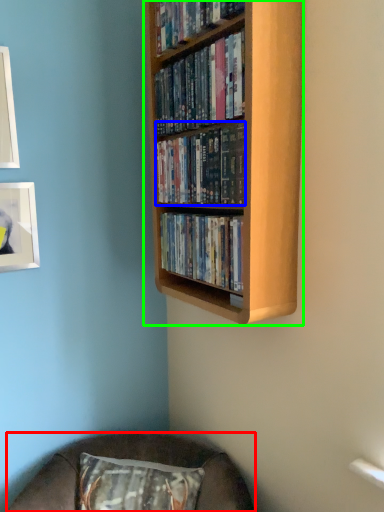
Question: Which object is positioned closest to furniture (highlighted by a red box)? Select from book (highlighted by a blue box) and bookcase (highlighted by a green box).

Choices:
 (A) book
 (B) bookcase

Answer: (B)